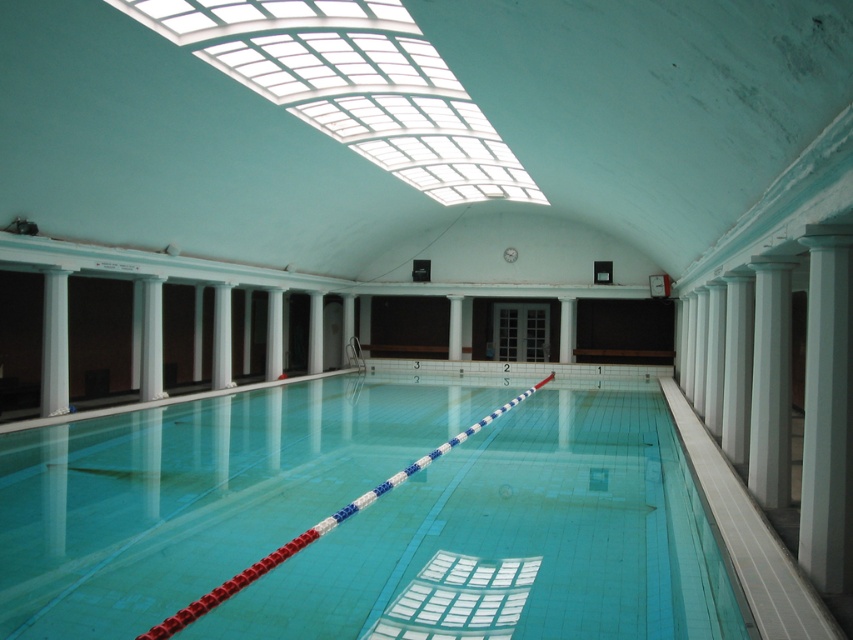
You are standing at the edge of the blue glossy pool at center and want to reach the white smooth column at right. Which direction should you move to get closer to the column?

You should move upward because the blue glossy pool at center is below the white smooth column at right, so moving upward towards the column will bring you closer.

Based on the photo, you are a swimmer standing at the edge of the blue glossy pool at center and want to reach the white smooth column at right. Which direction should you move to get closer to the column?

Since the blue glossy pool at center is to the left of the white smooth column at right, you should move to your right to get closer to the column.

You are standing at the edge of the indoor swimming pool and want to reach a point marked as point (398, 444). If your maximum reach distance is 10 meters, can you touch it without moving?

The point (398, 444) is 11.67 meters away from you, which exceeds your maximum reach distance of 10 meters. Therefore, you cannot touch it without moving.